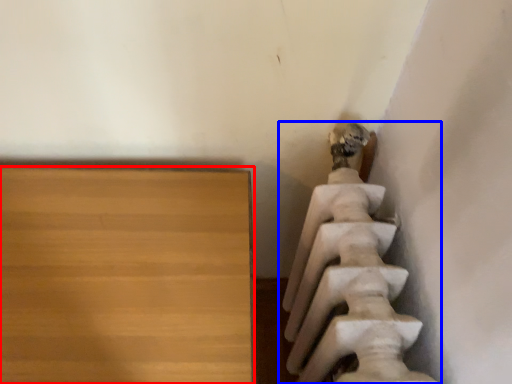
Question: Which of the following is the farthest to the observer, furniture (highlighted by a red box) or statue (sculpture) (highlighted by a blue box)?

Choices:
 (A) furniture
 (B) statue (sculpture)

Answer: (A)